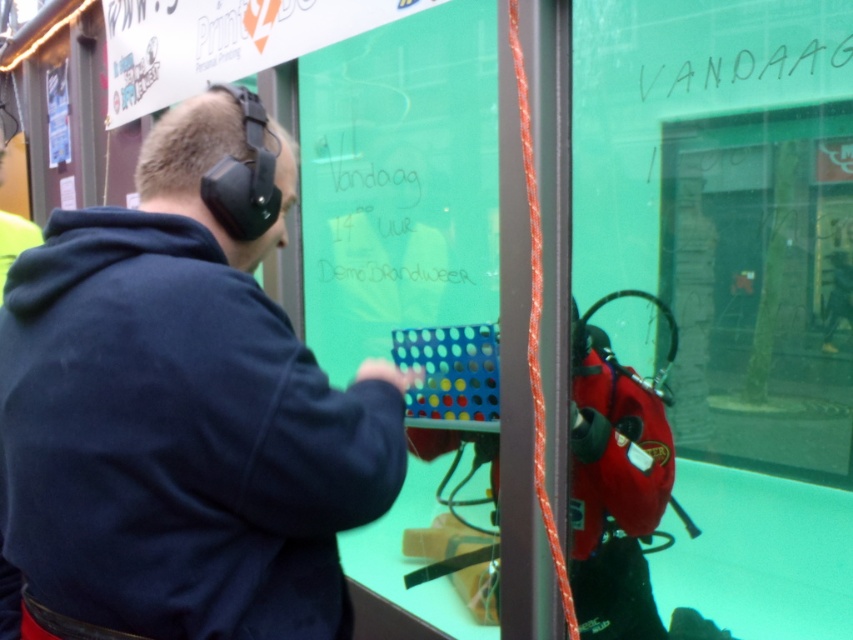
You are a security guard observing the tank and its surroundings. You notice the dark blue hoodie at upper left and the black handwritten text at upper right. Which object is positioned higher in the image?

The dark blue hoodie at upper left is taller than the black handwritten text at upper right, so the dark blue hoodie at upper left is positioned higher in the image.